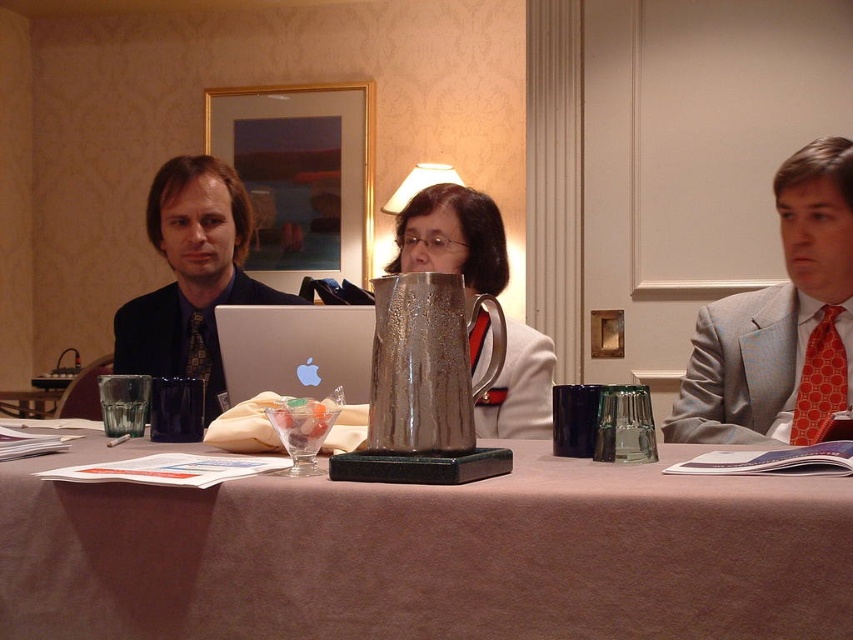
Question: Is light gray suit at right above red dotted tie at right?

Choices:
 (A) yes
 (B) no

Answer: (A)

Question: Where is brushed metal laptop at left located in relation to black textured tie at left in the image?

Choices:
 (A) below
 (B) above

Answer: (B)

Question: Which of the following is the closest to the observer?

Choices:
 (A) coord(749,426)
 (B) coord(221,352)

Answer: (B)

Question: Estimate the real-world distances between objects in this image. Which object is farther from the silver metallic laptop at center?

Choices:
 (A) brushed metal laptop at left
 (B) red dotted tie at right
 (C) black textured tie at left

Answer: (B)

Question: Does brushed metal laptop at left appear under black textured tie at left?

Choices:
 (A) yes
 (B) no

Answer: (B)

Question: Which object appears farthest from the camera in this image?

Choices:
 (A) black textured tie at left
 (B) silver metallic laptop at center

Answer: (A)